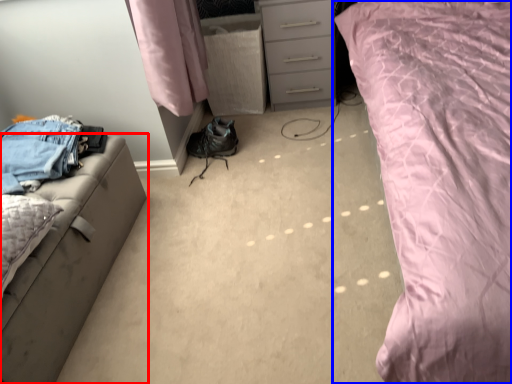
Question: Among these objects, which one is farthest to the camera, furniture (highlighted by a red box) or bed (highlighted by a blue box)?

Choices:
 (A) furniture
 (B) bed

Answer: (A)